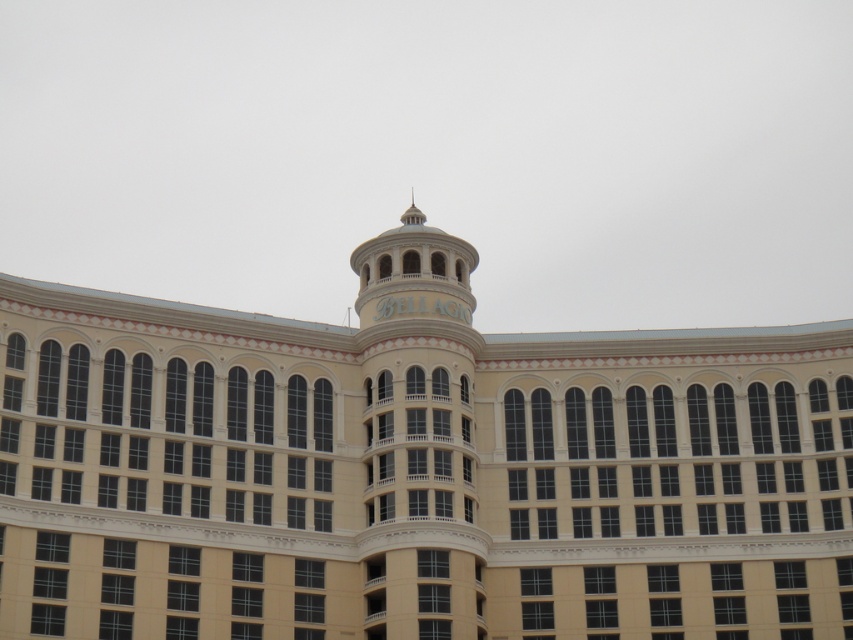
Is beige stone building at center thinner than white marble bell tower at center?

No, beige stone building at center is not thinner than white marble bell tower at center.

Who is shorter, beige stone building at center or white marble bell tower at center?

white marble bell tower at center is shorter.

Where is `beige stone building at center`? The width and height of the screenshot is (853, 640). beige stone building at center is located at coordinates (415, 476).

Find the location of `beige stone building at center`. beige stone building at center is located at coordinates (415, 476).